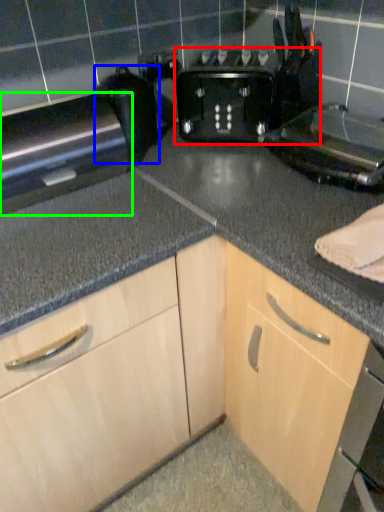
Question: Considering the real-world distances, which object is closest to toaster (highlighted by a red box)? appliance (highlighted by a blue box) or appliance (highlighted by a green box).

Choices:
 (A) appliance
 (B) appliance

Answer: (A)